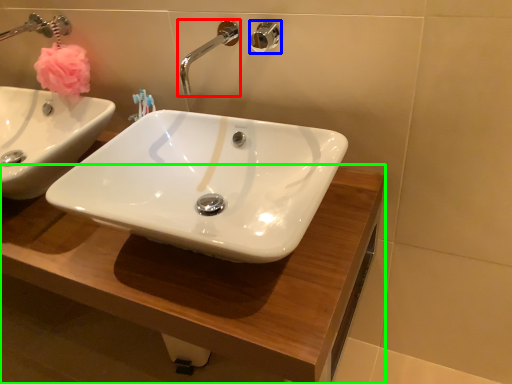
Question: Which object is positioned closest to tap (highlighted by a red box)? Select from shower (highlighted by a blue box) and counter top (highlighted by a green box).

Choices:
 (A) shower
 (B) counter top

Answer: (A)